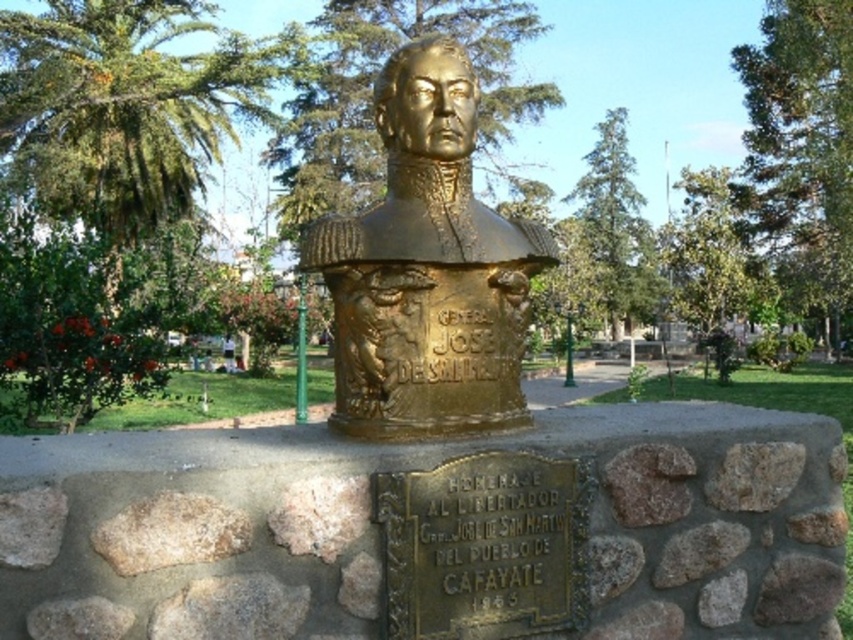
Question: Does gold polished bust at center lie in front of rough textured stone at lower left?

Choices:
 (A) yes
 (B) no

Answer: (B)

Question: Which point is farther from the camera taking this photo?

Choices:
 (A) (157, 493)
 (B) (445, 205)
 (C) (68, 97)

Answer: (C)

Question: Does green leafy palm tree at upper center lie in front of rough textured stone at lower left?

Choices:
 (A) yes
 (B) no

Answer: (B)

Question: Does gold polished bust at center appear over rough textured stone at lower left?

Choices:
 (A) no
 (B) yes

Answer: (B)

Question: Among these points, which one is farthest from the camera?

Choices:
 (A) (383, 374)
 (B) (125, 529)
 (C) (122, 241)

Answer: (C)

Question: Which of the following is the farthest from the observer?

Choices:
 (A) rough textured stone at lower left
 (B) green leafy palm tree at upper center
 (C) gold polished bust at center

Answer: (B)